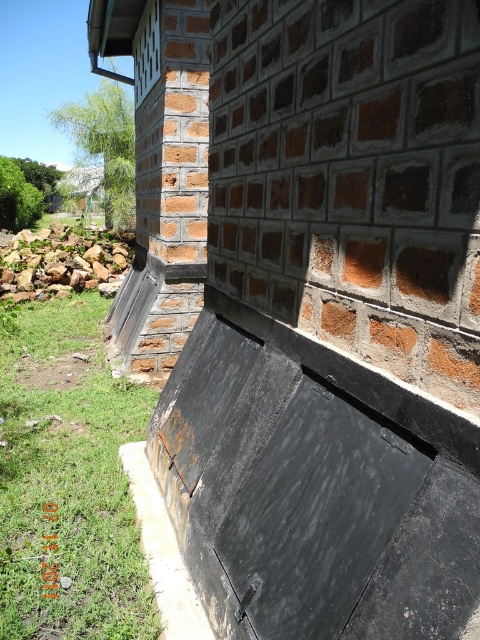
You are standing in front of a brick wall and want to determine which of the two points, point (35, 371) or point (15, 300), is nearer to you. Based on the scene description, which point is closer?

Point (35, 371) is closer to the camera than point (15, 300), so it is the nearer point.

You are a gardener planning to plant flowers in the area near the building. You notice the green grass at lower left and the brown rough stone at lower left. Which of these two items takes up more space in that area?

The brown rough stone at lower left takes up more space than the green grass at lower left because the green grass at lower left is smaller than the brown rough stone at lower left.

Consider the image. You are standing in front of the red brick wall and want to place a small potted plant between the green grass at lower left and the brown rough stone at lower left. Which object should you place it closer to if you want the plant to be closer to the viewer?

The green grass at lower left is closer to the viewer than the brown rough stone at lower left, so placing the potted plant closer to the green grass at lower left will make it closer to the viewer.